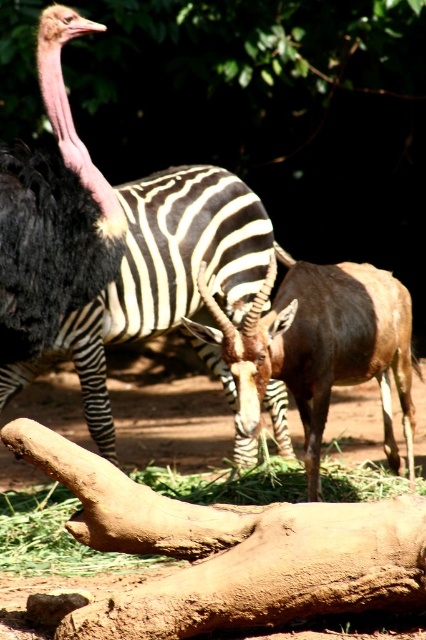
The width and height of the screenshot is (426, 640). Find the location of `brown glossy antelope at center`. brown glossy antelope at center is located at coordinates (319, 348).

Does brown glossy antelope at center have a greater width compared to green grass at lower center?

No, brown glossy antelope at center is not wider than green grass at lower center.

Image resolution: width=426 pixels, height=640 pixels. What are the coordinates of `brown glossy antelope at center` in the screenshot? It's located at (319, 348).

Does black and white striped zebra at center appear over brown glossy antelope at center?

Correct, black and white striped zebra at center is located above brown glossy antelope at center.

From the picture: Does black and white striped zebra at center have a lesser width compared to brown glossy antelope at center?

Incorrect, black and white striped zebra at center's width is not less than brown glossy antelope at center's.

This screenshot has width=426, height=640. What are the coordinates of `black and white striped zebra at center` in the screenshot? It's located at (160, 276).

The height and width of the screenshot is (640, 426). Identify the location of black and white striped zebra at center. coord(160,276).

Between black and white striped zebra at center and black feathered ostrich at left, which one is positioned higher?

black feathered ostrich at left is higher up.

Can you confirm if black and white striped zebra at center is shorter than black feathered ostrich at left?

No.

Where is `black and white striped zebra at center`? The image size is (426, 640). black and white striped zebra at center is located at coordinates (160, 276).